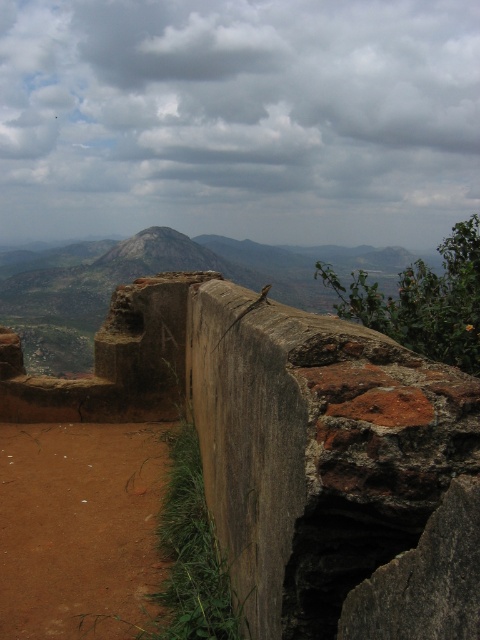
Question: Which point is closer to the camera?

Choices:
 (A) rusty brick wall at center
 (B) rustic stone peak at center

Answer: (A)

Question: Which of the following is the closest to the observer?

Choices:
 (A) (218, 257)
 (B) (405, 630)

Answer: (B)

Question: Does rusty brick wall at center appear on the right side of rustic stone peak at center?

Choices:
 (A) yes
 (B) no

Answer: (A)

Question: Considering the relative positions of rusty brick wall at center and rustic stone peak at center in the image provided, where is rusty brick wall at center located with respect to rustic stone peak at center?

Choices:
 (A) right
 (B) left

Answer: (A)

Question: Can you confirm if rusty brick wall at center is thinner than rustic stone peak at center?

Choices:
 (A) no
 (B) yes

Answer: (B)